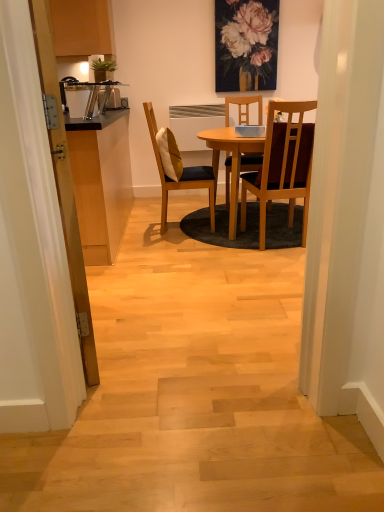
Locate an element on the screen. The image size is (384, 512). free space to the back side of wooden door at left is located at coordinates (124, 292).